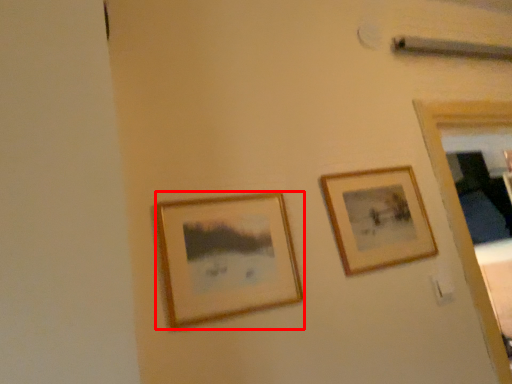
Question: From the image's perspective, considering the relative positions of picture frame (annotated by the red box) and picture frame in the image provided, where is picture frame (annotated by the red box) located with respect to the staircase?

Choices:
 (A) above
 (B) below

Answer: (B)